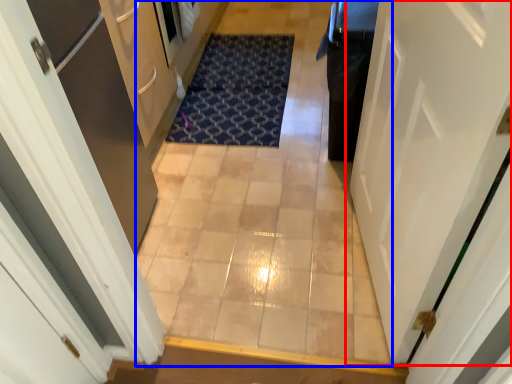
Question: Which object appears farthest to the camera in this image, door (highlighted by a red box) or corridor (highlighted by a blue box)?

Choices:
 (A) door
 (B) corridor

Answer: (B)